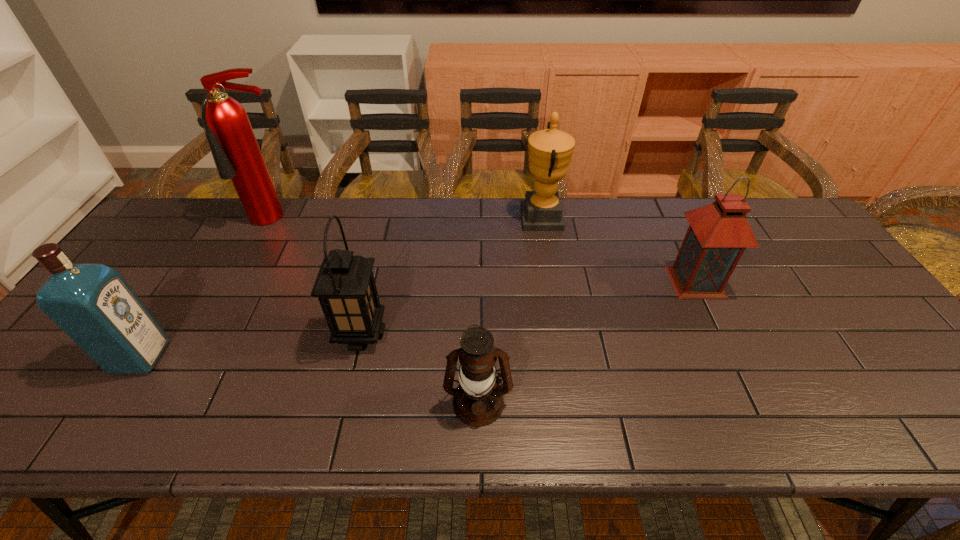
This screenshot has width=960, height=540. I want to click on free space in the image that satisfies the following two spatial constraints: 1. at the front of the award with handles; 2. on the side of the second lantern from right to left, there is a wick adjustment knob, so click(x=572, y=402).

Locate an element on the screen. This screenshot has height=540, width=960. vacant position in the image that satisfies the following two spatial constraints: 1. at the front of the award with handles; 2. on the front side of the leftmost lantern is located at coordinates (562, 334).

Where is `blank space that satisfies the following two spatial constraints: 1. at the nozzle of the leftmost lantern; 2. on the left side of the fire extinguisher`? Image resolution: width=960 pixels, height=540 pixels. blank space that satisfies the following two spatial constraints: 1. at the nozzle of the leftmost lantern; 2. on the left side of the fire extinguisher is located at coordinates (214, 334).